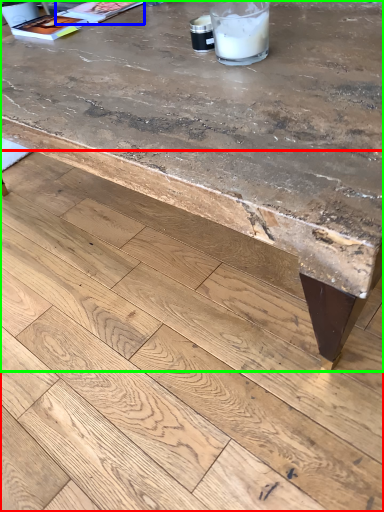
Question: Considering the real-world distances, which object is farthest from concrete (highlighted by a red box)? magazine (highlighted by a blue box) or table (highlighted by a green box)?

Choices:
 (A) magazine
 (B) table

Answer: (A)